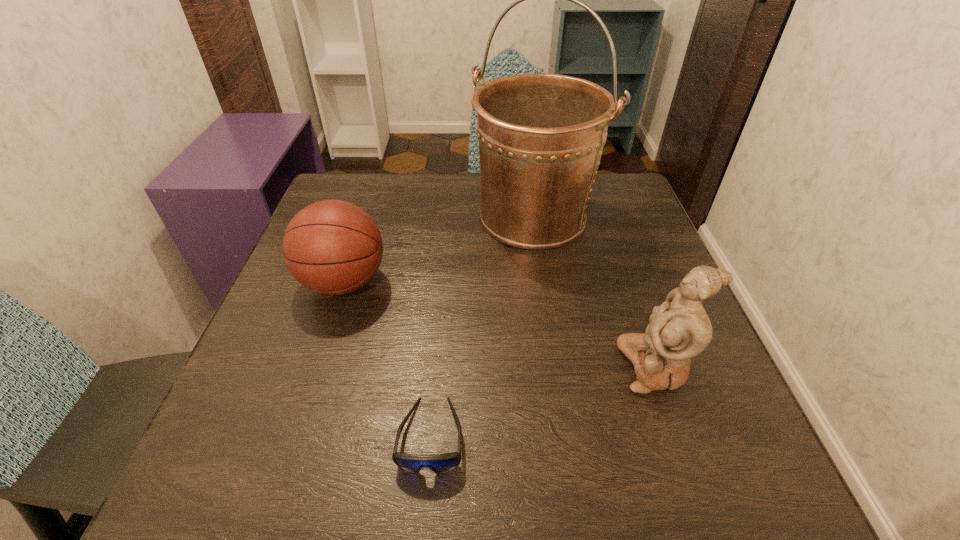
Find the location of a particular element. The width and height of the screenshot is (960, 540). the tallest object is located at coordinates (541, 135).

Locate an element on the screen. Image resolution: width=960 pixels, height=540 pixels. the second tallest object is located at coordinates (679, 329).

This screenshot has height=540, width=960. Identify the location of the second nearest object. (679, 329).

Locate an element on the screen. This screenshot has width=960, height=540. the leftmost object is located at coordinates (332, 247).

This screenshot has height=540, width=960. In order to click on basketball in this screenshot , I will do `click(332, 247)`.

The height and width of the screenshot is (540, 960). What are the coordinates of `the nearest object` in the screenshot? It's located at (440, 463).

The width and height of the screenshot is (960, 540). In order to click on the third object from right to left in this screenshot , I will do `click(440, 463)`.

This screenshot has width=960, height=540. Identify the location of vacant space situated on the front of the tallest object. (548, 320).

Where is `blank space located on the front-facing side of the figurine`? The width and height of the screenshot is (960, 540). blank space located on the front-facing side of the figurine is located at coordinates pos(558,367).

Find the location of a particular element. The width and height of the screenshot is (960, 540). vacant area situated on the front-facing side of the figurine is located at coordinates (546, 367).